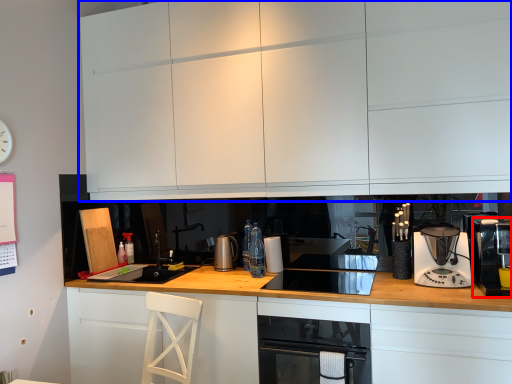
Question: Which of the following is the farthest to the observer, kitchen appliance (highlighted by a red box) or cabinetry (highlighted by a blue box)?

Choices:
 (A) kitchen appliance
 (B) cabinetry

Answer: (B)